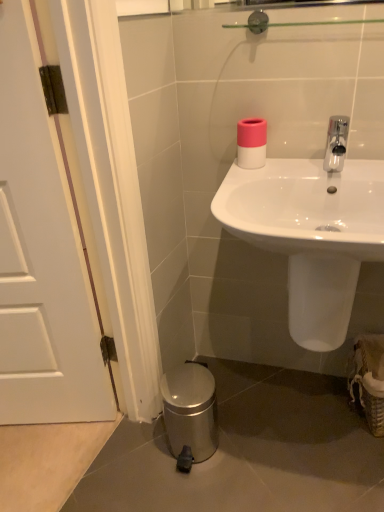
Question: From a real-world perspective, is pink matte toilet paper at upper center under white matte door at left?

Choices:
 (A) no
 (B) yes

Answer: (A)

Question: Would you say pink matte toilet paper at upper center is a long distance from white matte door at left?

Choices:
 (A) no
 (B) yes

Answer: (A)

Question: Considering the relative sizes of pink matte toilet paper at upper center and white matte door at left in the image provided, is pink matte toilet paper at upper center bigger than white matte door at left?

Choices:
 (A) yes
 (B) no

Answer: (B)

Question: Considering the relative positions of pink matte toilet paper at upper center and white matte door at left in the image provided, is pink matte toilet paper at upper center to the right of white matte door at left from the viewer's perspective?

Choices:
 (A) no
 (B) yes

Answer: (B)

Question: Is pink matte toilet paper at upper center further to camera compared to white matte door at left?

Choices:
 (A) yes
 (B) no

Answer: (A)

Question: Is polished chrome faucet at upper right situated inside pink matte toilet paper at upper center or outside?

Choices:
 (A) outside
 (B) inside

Answer: (A)

Question: Would you say polished chrome faucet at upper right is to the left or to the right of pink matte toilet paper at upper center in the picture?

Choices:
 (A) right
 (B) left

Answer: (A)

Question: From the image's perspective, is polished chrome faucet at upper right located above or below pink matte toilet paper at upper center?

Choices:
 (A) below
 (B) above

Answer: (A)

Question: From a real-world perspective, is polished chrome faucet at upper right positioned above or below pink matte toilet paper at upper center?

Choices:
 (A) below
 (B) above

Answer: (B)

Question: Choose the correct answer: Is white matte door at left inside polished chrome faucet at upper right or outside it?

Choices:
 (A) inside
 (B) outside

Answer: (B)

Question: Considering their positions, is white matte door at left located in front of or behind polished chrome faucet at upper right?

Choices:
 (A) behind
 (B) front

Answer: (B)

Question: Is white matte door at left wider or thinner than polished chrome faucet at upper right?

Choices:
 (A) thin
 (B) wide

Answer: (A)

Question: From a real-world perspective, is white matte door at left physically located above or below polished chrome faucet at upper right?

Choices:
 (A) below
 (B) above

Answer: (A)

Question: Visually, is polished chrome faucet at upper right positioned to the left or to the right of white glossy sink at center?

Choices:
 (A) right
 (B) left

Answer: (A)

Question: Is polished chrome faucet at upper right bigger or smaller than white glossy sink at center?

Choices:
 (A) small
 (B) big

Answer: (A)